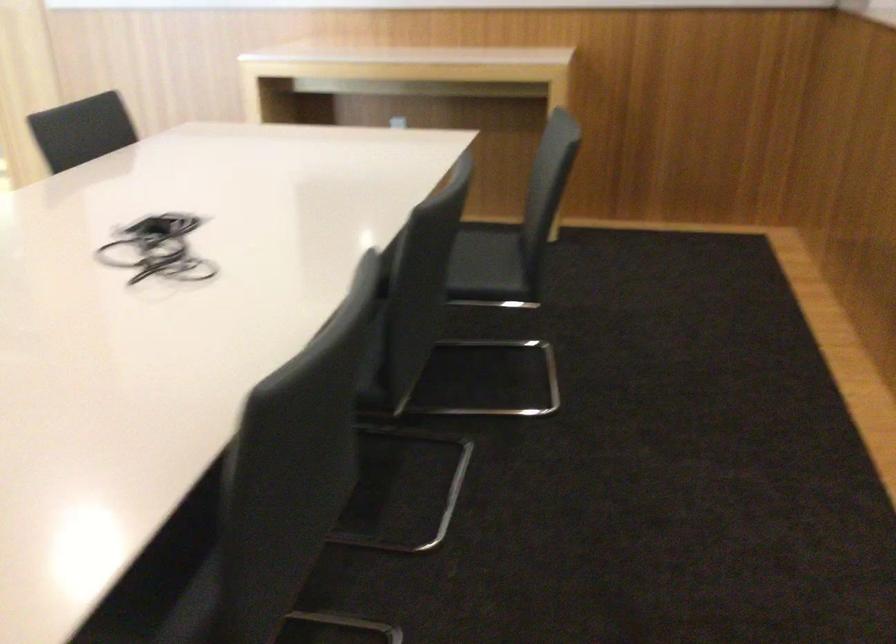
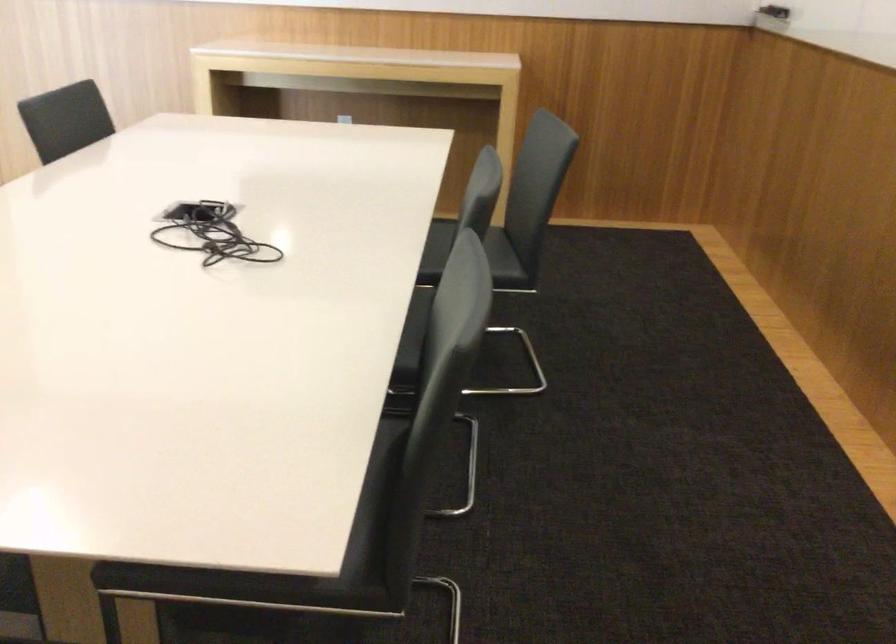
The images are taken continuously from a first-person perspective. In which direction are you moving?

The movement direction of the cameraman is left, backward.